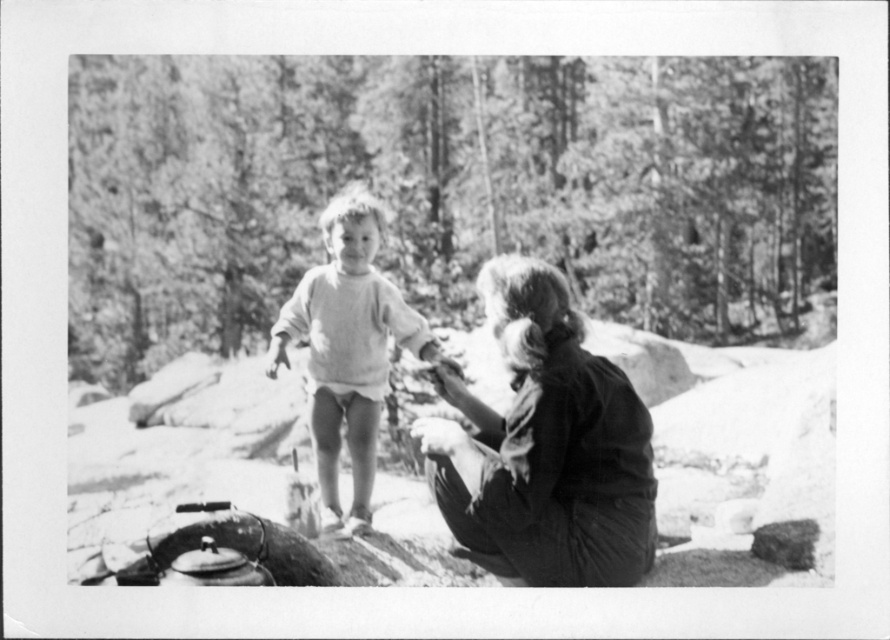
Which of these two, dark fabric skirt at center or white soft sweater at center, stands taller?

With more height is white soft sweater at center.

Who is positioned more to the right, dark fabric skirt at center or white soft sweater at center?

From the viewer's perspective, dark fabric skirt at center appears more on the right side.

Who is more distant from viewer, (518, 394) or (352, 244)?

Positioned behind is point (352, 244).

Where is `dark fabric skirt at center`? The height and width of the screenshot is (640, 890). dark fabric skirt at center is located at coordinates (545, 445).